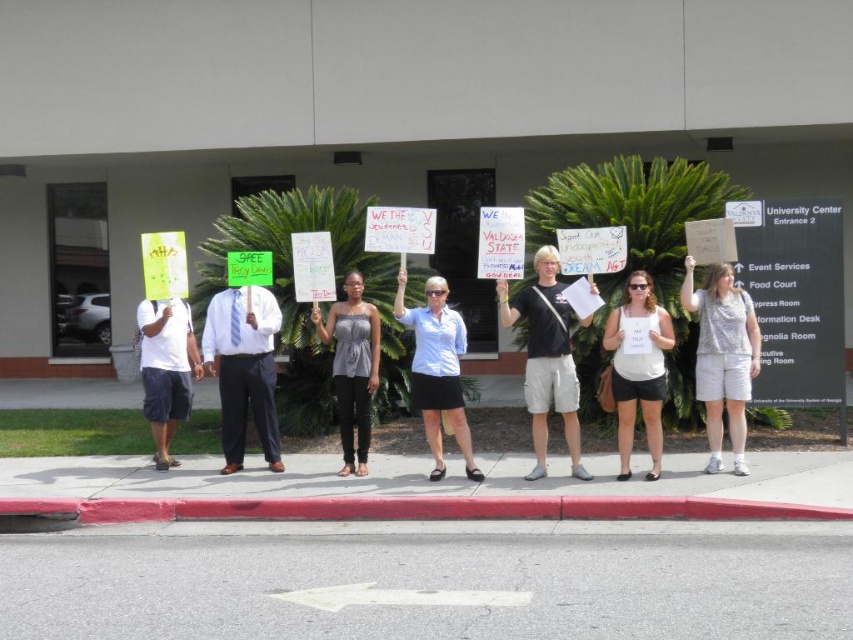
Which is below, white cotton shorts at center or matte gray tank top at center?

matte gray tank top at center is below.

The width and height of the screenshot is (853, 640). I want to click on white cotton shorts at center, so click(722, 356).

Who is taller, white cotton tank top at center or matte gray tank top at center?

matte gray tank top at center is taller.

Which is more to the right, white cotton tank top at center or matte gray tank top at center?

white cotton tank top at center

The height and width of the screenshot is (640, 853). Describe the element at coordinates (637, 371) in the screenshot. I see `white cotton tank top at center` at that location.

Find the location of a particular element. white cotton tank top at center is located at coordinates (637, 371).

Does matte gray tank top at center appear over white paper sign at center?

No, matte gray tank top at center is not above white paper sign at center.

Between matte gray tank top at center and white paper sign at center, which one is positioned higher?

white paper sign at center is higher up.

Is point (320, 314) closer to camera compared to point (410, 237)?

No, (320, 314) is further to viewer.

Find the location of a particular element. Image resolution: width=853 pixels, height=640 pixels. matte gray tank top at center is located at coordinates (352, 368).